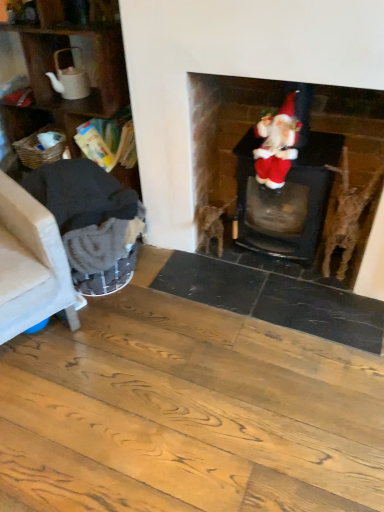
Question: Relative to velvet santa at center, is dark gray fabric armchair at left, which is the first armchair from right to left, in front or behind?

Choices:
 (A) behind
 (B) front

Answer: (B)

Question: From their relative heights in the image, would you say dark gray fabric armchair at left, marked as the second armchair in a left-to-right arrangement, is taller or shorter than velvet santa at center?

Choices:
 (A) tall
 (B) short

Answer: (A)

Question: Which object is the closest to the beige fabric armchair at left, placed as the 2th armchair when sorted from right to left?

Choices:
 (A) wooden textured shelf at left
 (B) dark gray fabric armchair at left, marked as the second armchair in a left-to-right arrangement
 (C) velvet santa at center
 (D) velvet santa at upper right

Answer: (B)

Question: Which object is the farthest from the beige fabric armchair at left, acting as the first armchair starting from the left?

Choices:
 (A) velvet santa at center
 (B) dark gray fabric armchair at left, marked as the second armchair in a left-to-right arrangement
 (C) wooden textured shelf at left
 (D) velvet santa at upper right

Answer: (A)